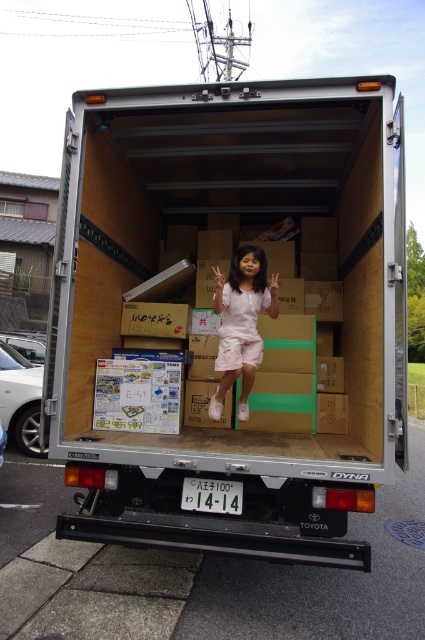
Question: Which point is farther to the camera?

Choices:
 (A) silver metallic truck at center
 (B) white plastic license plate at center
 (C) white matte shorts at center

Answer: (C)

Question: Does silver metallic truck at center appear on the left side of white matte shorts at center?

Choices:
 (A) yes
 (B) no

Answer: (A)

Question: Can you confirm if silver metallic truck at center is positioned to the left of white plastic license plate at center?

Choices:
 (A) yes
 (B) no

Answer: (B)

Question: Which point is farther to the camera?

Choices:
 (A) (255, 362)
 (B) (223, 490)

Answer: (A)

Question: Is white matte shorts at center below white plastic license plate at center?

Choices:
 (A) no
 (B) yes

Answer: (A)

Question: Which object is farther from the camera taking this photo?

Choices:
 (A) silver metallic truck at center
 (B) white matte shorts at center

Answer: (B)